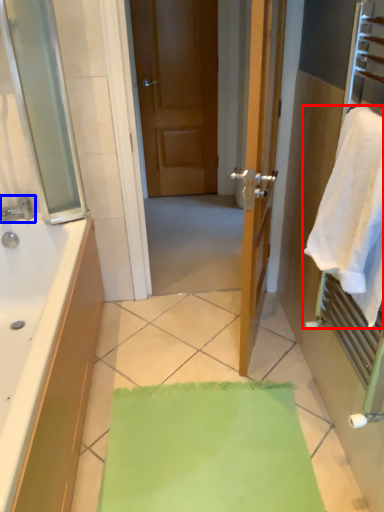
Question: Which object is further to the camera taking this photo, towel (highlighted by a red box) or tap (highlighted by a blue box)?

Choices:
 (A) towel
 (B) tap

Answer: (B)